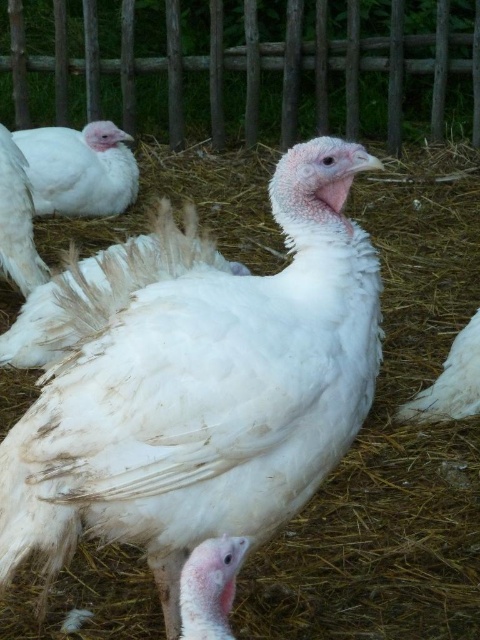
You are a farmer checking on your turkeys. You notice the wooden fence at upper center and the white feathered turkey at left. Which one is taller?

The wooden fence at upper center is taller than the white feathered turkey at left.

You are a farmer checking the coop and notice two birds at the left side. Which one is shorter between the white feathered turkey at left and the white feathered chicken at left?

The white feathered turkey at left is shorter than the white feathered chicken at left.

You are a farmer checking the poultry area. You notice the wooden fence at upper center and the white feathered chicken at lower right. Which object is bigger in size?

The wooden fence at upper center is larger in size compared to the white feathered chicken at lower right according to the description.